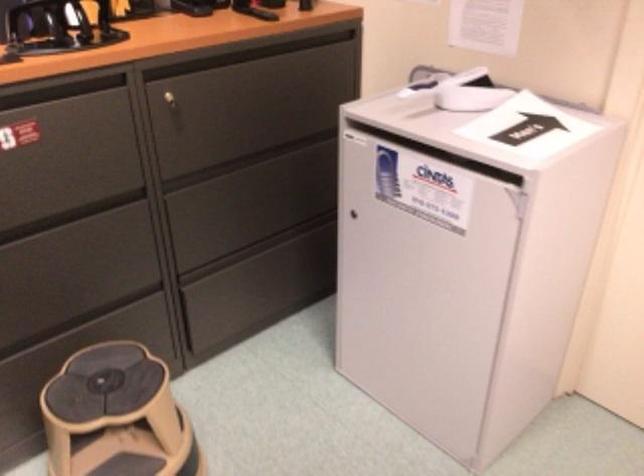
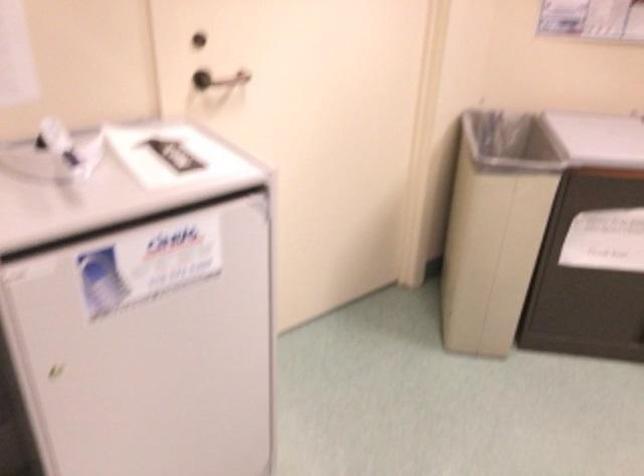
Where in the second image is the point corresponding to point 395,247 from the first image?

(146, 343)